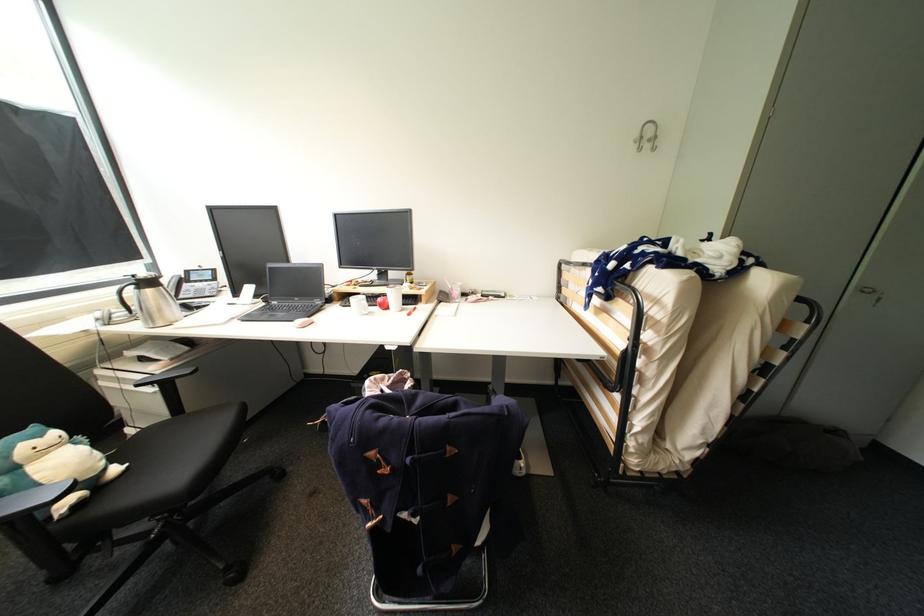
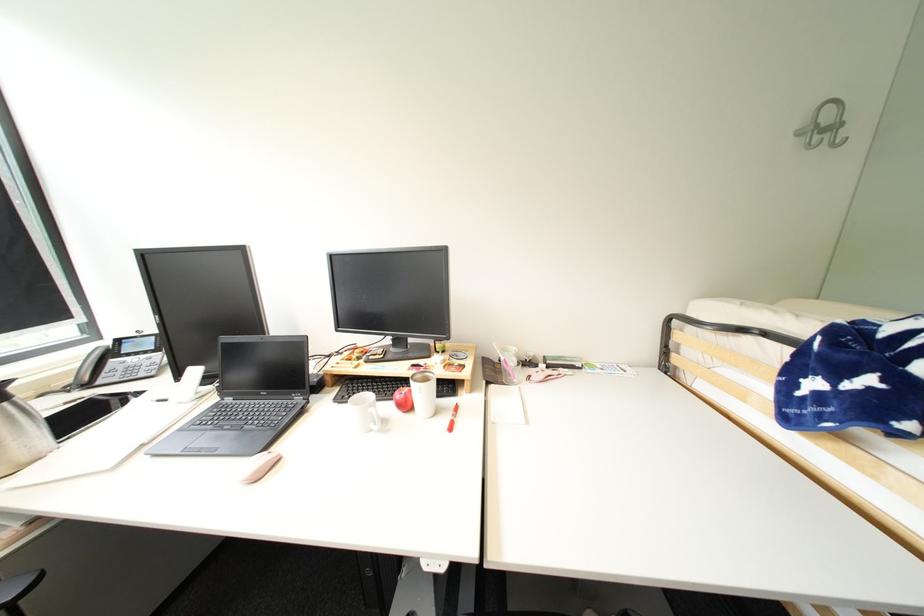
Locate, in the second image, the point that corresponds to point 385,300 in the first image.

(405, 397)